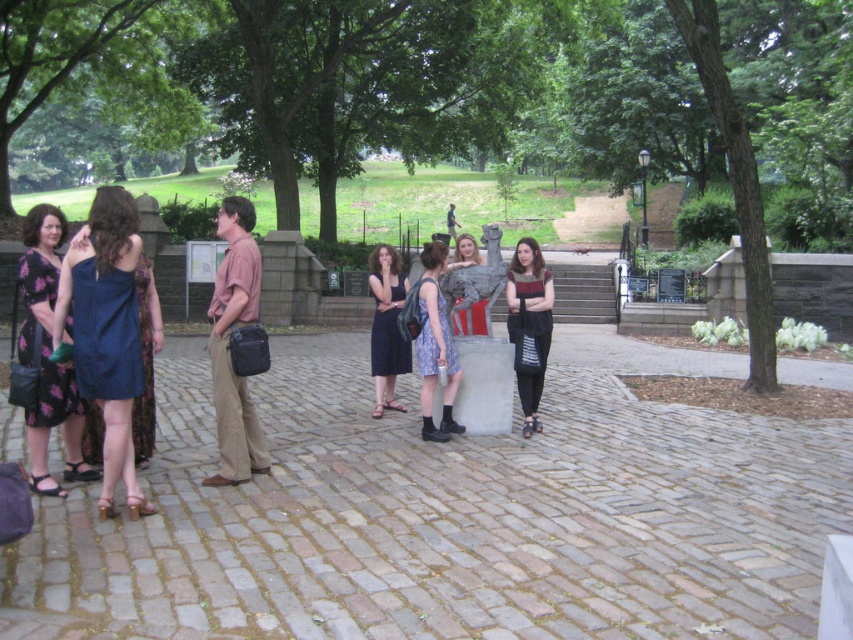
Is point (103, 452) closer to viewer compared to point (392, 252)?

Yes, point (103, 452) is closer to viewer.

Does point (112, 340) come farther from viewer compared to point (392, 394)?

That is False.

What do you see at coordinates (106, 333) in the screenshot? The width and height of the screenshot is (853, 640). I see `matte blue dress at left` at bounding box center [106, 333].

Identify the location of matte blue dress at left. (106, 333).

Is matte blue dress at left shorter than floral print dress at left?

Yes, matte blue dress at left is shorter than floral print dress at left.

Does point (131, 460) come farther from viewer compared to point (47, 212)?

No.

Which is in front, point (126, 330) or point (49, 484)?

Point (126, 330) is in front.

I want to click on matte blue dress at left, so point(106,333).

Describe the element at coordinates (106, 333) in the screenshot. I see `matte blue dress at left` at that location.

Does point (83, 368) come in front of point (432, 336)?

Yes, it is in front of point (432, 336).

Locate an element on the screen. matte blue dress at left is located at coordinates (106, 333).